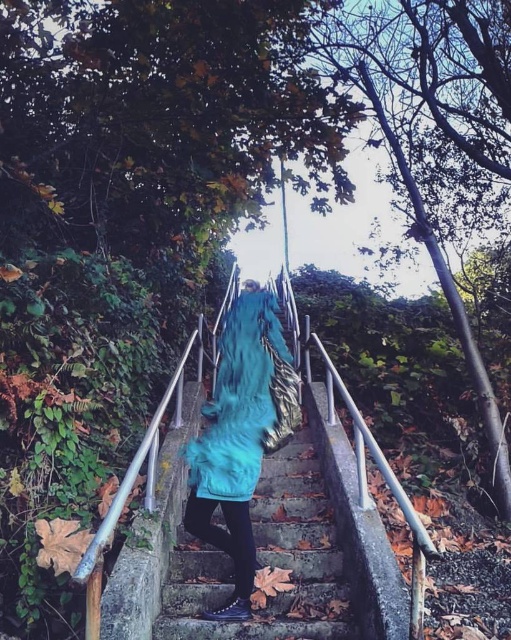
Question: Is stone textured stairs at center positioned behind teal fuzzy coat at center?

Choices:
 (A) no
 (B) yes

Answer: (A)

Question: Can you confirm if stone textured stairs at center is positioned below teal fuzzy coat at center?

Choices:
 (A) yes
 (B) no

Answer: (A)

Question: Can you confirm if stone textured stairs at center is positioned to the left of teal fuzzy coat at center?

Choices:
 (A) yes
 (B) no

Answer: (B)

Question: Among these objects, which one is nearest to the camera?

Choices:
 (A) stone textured stairs at center
 (B) teal fuzzy coat at center

Answer: (A)